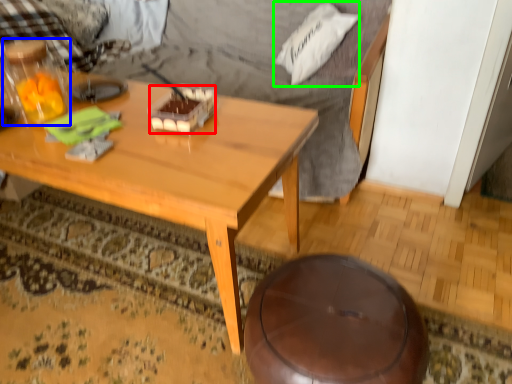
Question: Which is farther away from food (highlighted by a red box)? bottle (highlighted by a blue box) or pillow (highlighted by a green box)?

Choices:
 (A) bottle
 (B) pillow

Answer: (B)